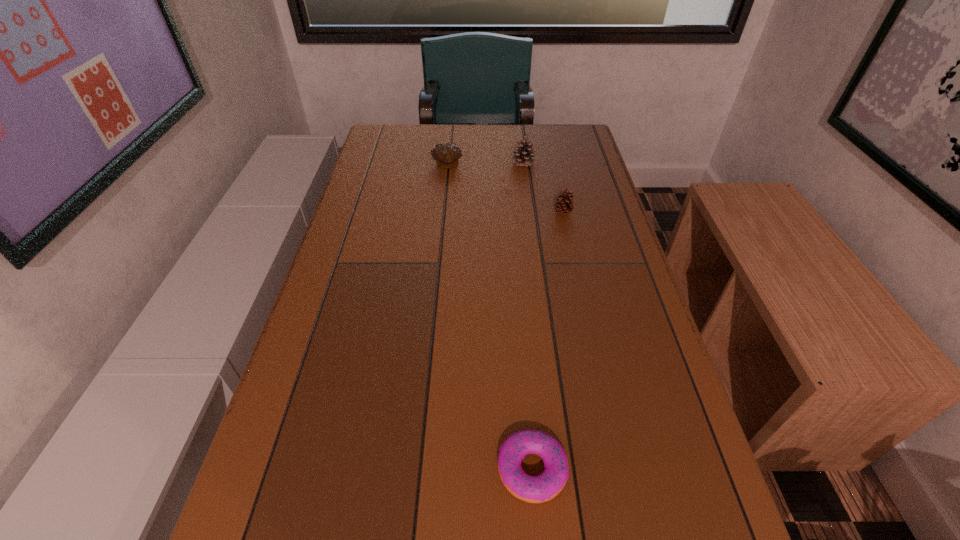
Locate an element on the screen. vacant space positioned on the left of the shortest object is located at coordinates (266, 470).

Identify the location of pinecone located in the far edge section of the desktop. The height and width of the screenshot is (540, 960). (525, 156).

Where is `muffin that is positioned at the far edge`? The image size is (960, 540). muffin that is positioned at the far edge is located at coordinates (446, 155).

This screenshot has height=540, width=960. Identify the location of object that is at the right edge. (563, 206).

At what (x,y) coordinates should I click in order to perform the action: click on blank area at the far edge. Please return your answer as a coordinate pair (x, y). Looking at the image, I should click on (458, 134).

In the image, there is a desktop. Where is `free space at the left edge`? This screenshot has width=960, height=540. free space at the left edge is located at coordinates (380, 330).

In order to click on vacant space at the right edge of the desktop in this screenshot , I will do `click(594, 350)`.

The height and width of the screenshot is (540, 960). I want to click on free spot at the far left corner of the desktop, so click(392, 157).

Find the location of a particular element. The height and width of the screenshot is (540, 960). vacant space that's between the third farthest object and the farther pinecone is located at coordinates (543, 188).

Where is `unoccupied area between the nearer pinecone and the nearest object`? The image size is (960, 540). unoccupied area between the nearer pinecone and the nearest object is located at coordinates (547, 341).